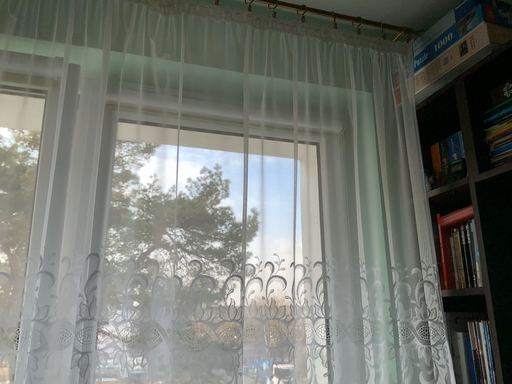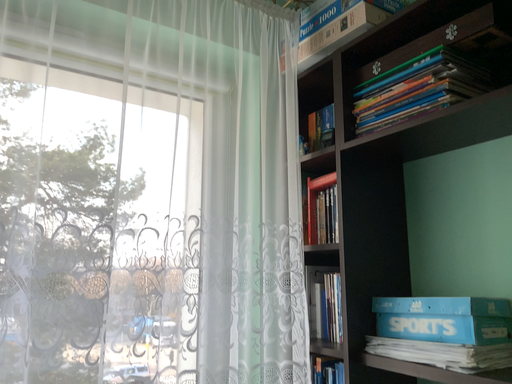
Question: How did the camera likely rotate when shooting the video?

Choices:
 (A) rotated left
 (B) rotated right

Answer: (B)